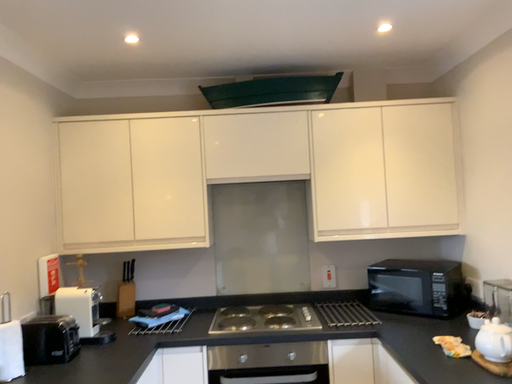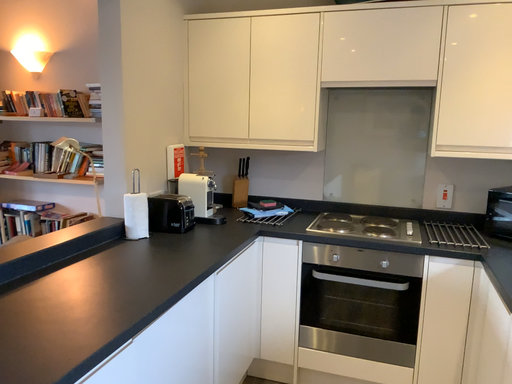
Question: How did the camera likely rotate when shooting the video?

Choices:
 (A) rotated left
 (B) rotated right

Answer: (A)